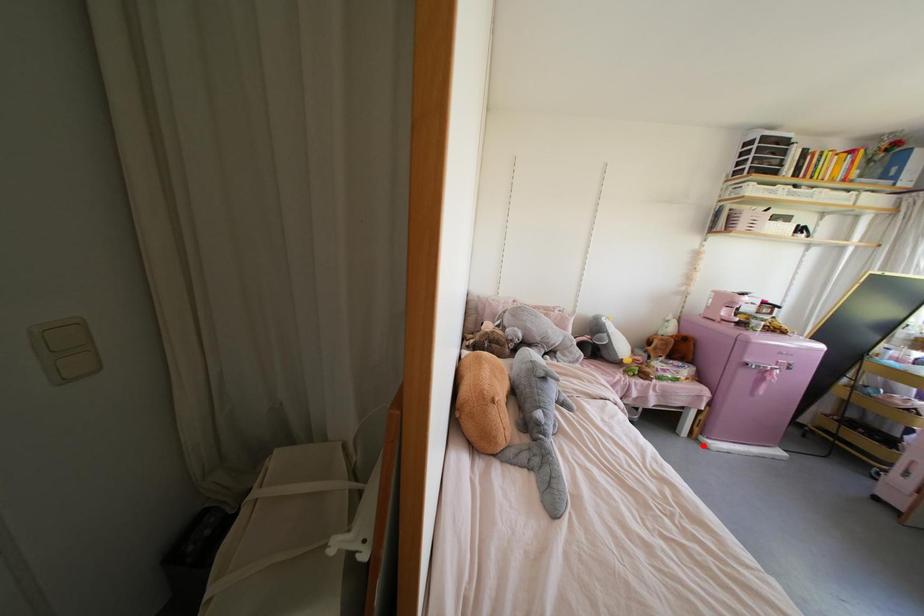
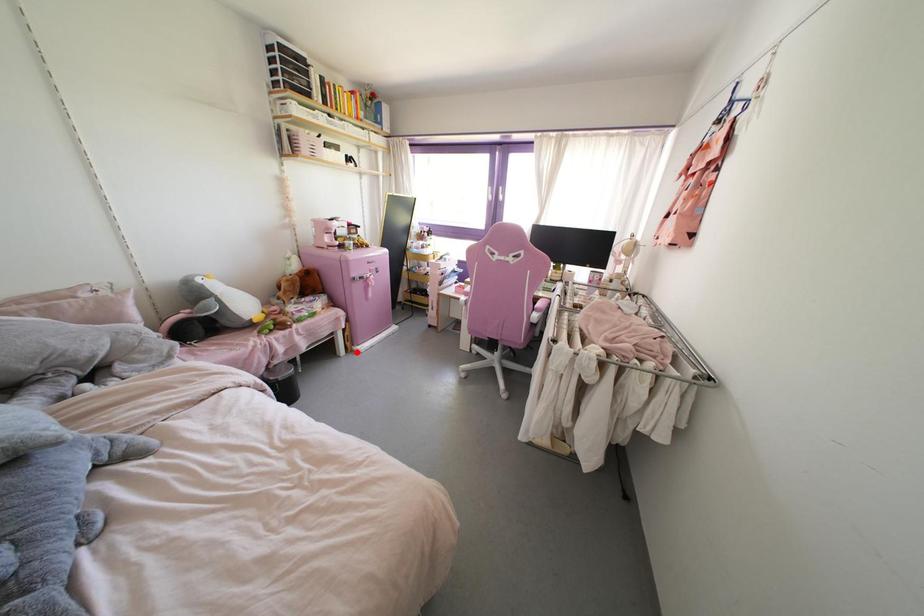
I am providing you with two images of the same scene from different viewpoints. A red point is marked on the first image and another point is marked on the second image. Is the red point in image1 aligned with the point shown in image2?

Yes